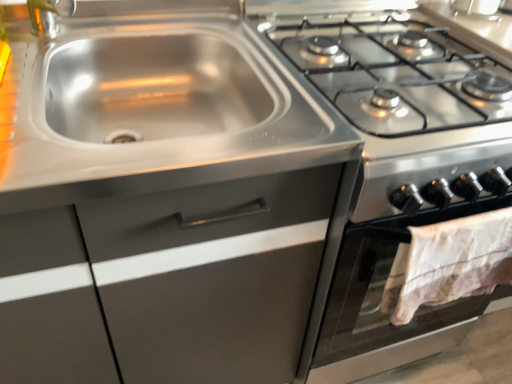
Question: Based on their positions, is stainless steel sink at upper left located to the left or right of stainless steel cabinet at upper left?

Choices:
 (A) right
 (B) left

Answer: (A)

Question: Is point (215, 92) closer or farther from the camera than point (172, 319)?

Choices:
 (A) closer
 (B) farther

Answer: (B)

Question: Estimate the real-world distances between objects in this image. Which object is farther from the stainless steel stove at upper right?

Choices:
 (A) white lace towel at lower right
 (B) stainless steel sink at upper left
 (C) stainless steel cabinet at upper left

Answer: (B)

Question: Which object is positioned farthest from the stainless steel stove at upper right?

Choices:
 (A) stainless steel cabinet at upper left
 (B) white lace towel at lower right
 (C) stainless steel sink at upper left

Answer: (C)